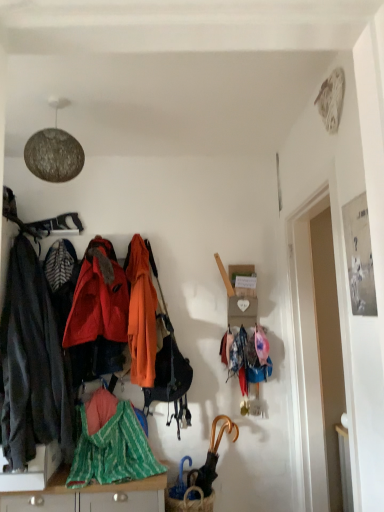
Question: From a real-world perspective, relative to orange matte handbag at center, is green striped fabric at lower center vertically above or below?

Choices:
 (A) above
 (B) below

Answer: (B)

Question: Do you think green striped fabric at lower center is within orange matte handbag at center, or outside of it?

Choices:
 (A) outside
 (B) inside

Answer: (A)

Question: Which is nearer to the wooden cabinet at lower center?

Choices:
 (A) dark gray fabric jacket at left, which is counted as the 1th jacket, starting from the left
 (B) green striped fabric at lower left
 (C) orange cotton jacket at center, placed as the 3th jacket when sorted from left to right
 (D) green striped fabric at lower center
 (E) fuzzy pink hat at center-right

Answer: (D)

Question: Estimate the real-world distances between objects in this image. Which object is closer to the orange cotton jacket at center, which appears as the first jacket when viewed from the right?

Choices:
 (A) shiny red jacket at center, arranged as the 2th jacket when viewed from the left
 (B) orange matte handbag at center
 (C) green striped fabric at lower left
 (D) gold metallic umbrella at lower center
 (E) wooden cabinet at lower center

Answer: (B)